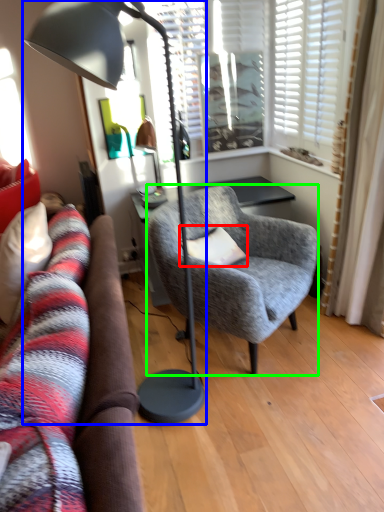
Question: Estimate the real-world distances between objects in this image. Which object is closer to pillow (highlighted by a red box), lamp (highlighted by a blue box) or chair (highlighted by a green box)?

Choices:
 (A) lamp
 (B) chair

Answer: (B)